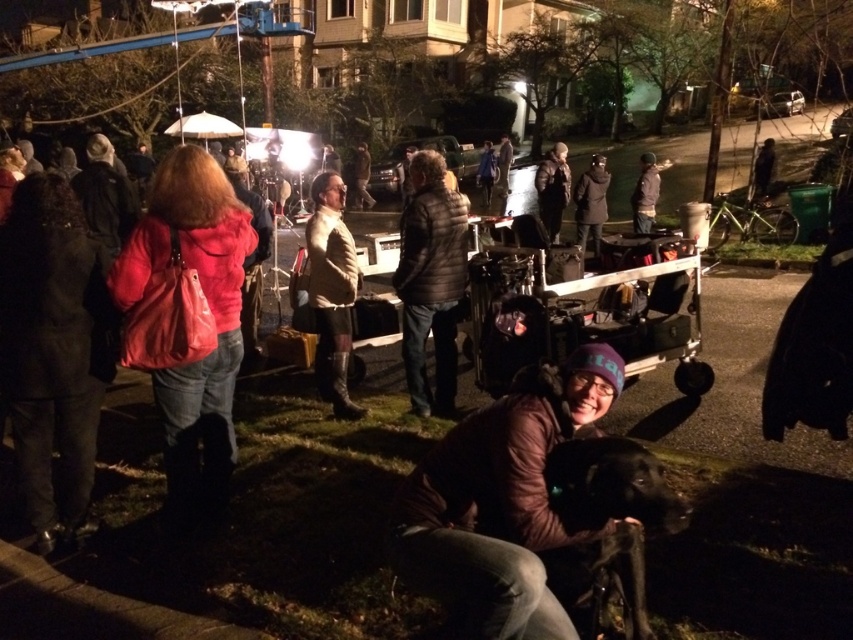
Which is more to the left, brown leather jacket at lower center or metallic silver cart at center?

Positioned to the left is brown leather jacket at lower center.

Does brown leather jacket at lower center have a greater height compared to metallic silver cart at center?

No.

Who is more distant from viewer, [590,529] or [494,269]?

The point [494,269] is more distant.

Identify the location of brown leather jacket at lower center. This screenshot has width=853, height=640. (502, 500).